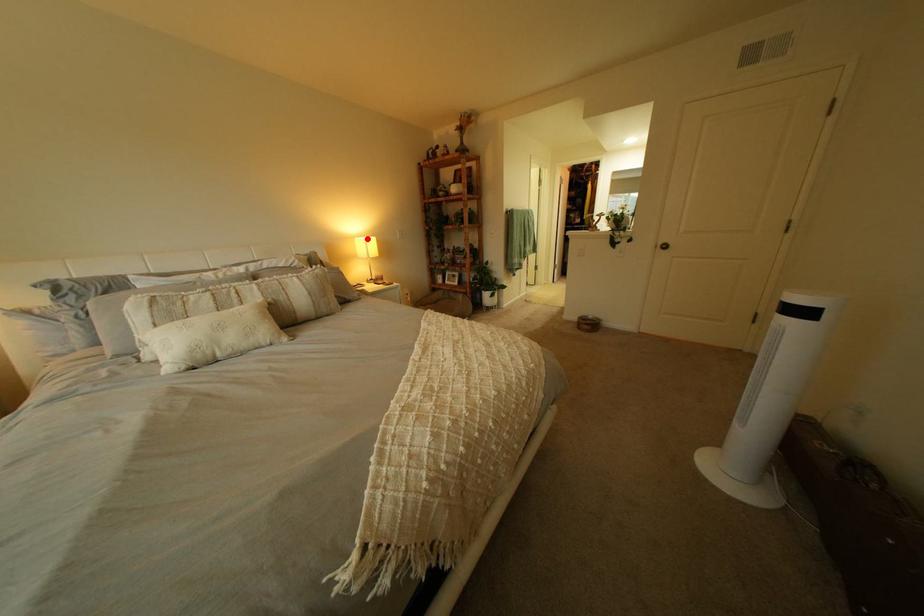
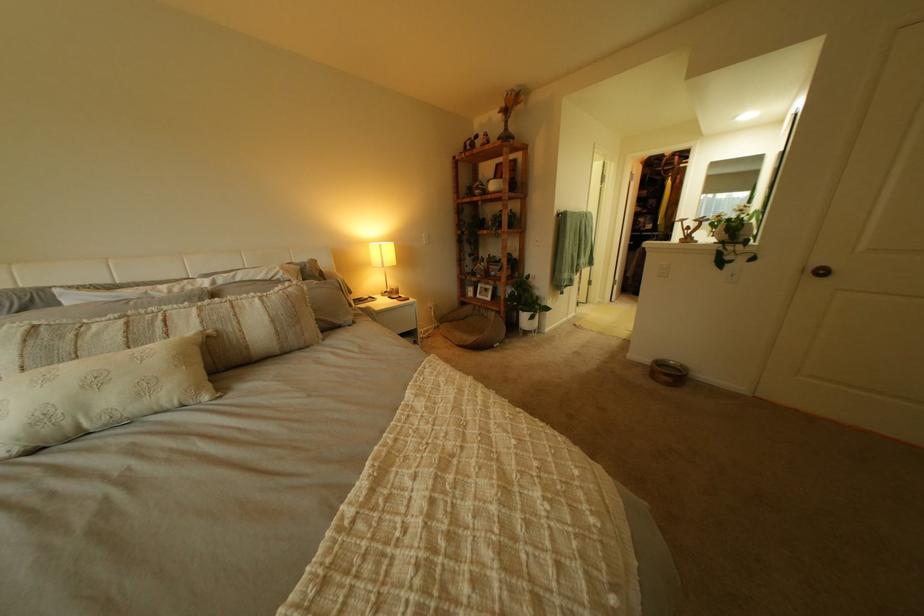
In the second image, find the point that corresponds to the highlighted location in the first image.

(381, 244)